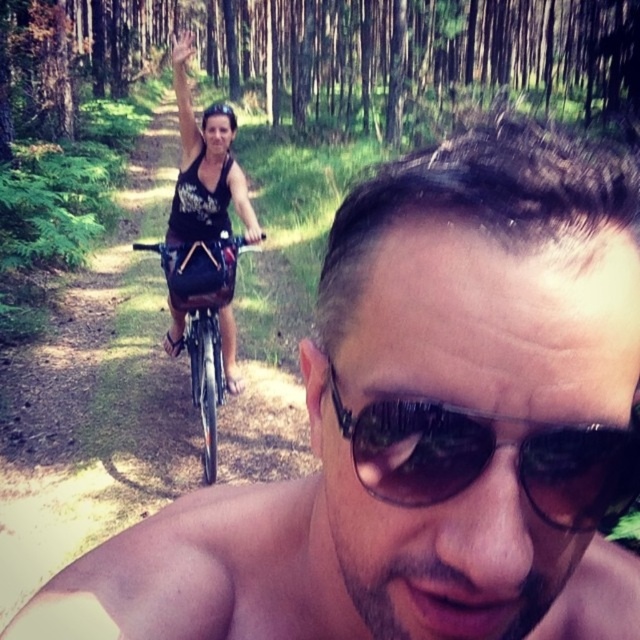
You are a photographer trying to capture both the black reflective sunglasses at center and the silver metallic bicycle at center in the same frame. Based on their sizes, which object should you focus on first to ensure both are fully visible in your photo?

The black reflective sunglasses at center is not as tall as the silver metallic bicycle at center, so you should focus on the silver metallic bicycle at center first to ensure both objects are fully visible in the photo.

You are a photographer trying to capture both the black fabric tank top at upper left and the silver metallic bicycle at center in a single frame. Based on their sizes, which object should you focus on first to ensure both fit in the shot?

The black fabric tank top at upper left might be wider than the silver metallic bicycle at center, so you should focus on the black fabric tank top at upper left first to ensure both fit in the shot.

You are a photographer trying to capture the scene. The black fabric tank top at upper left and the silver metallic bicycle at center are both in your frame. Which object appears taller in the photo?

The black fabric tank top at upper left appears taller than the silver metallic bicycle at center in the photo.